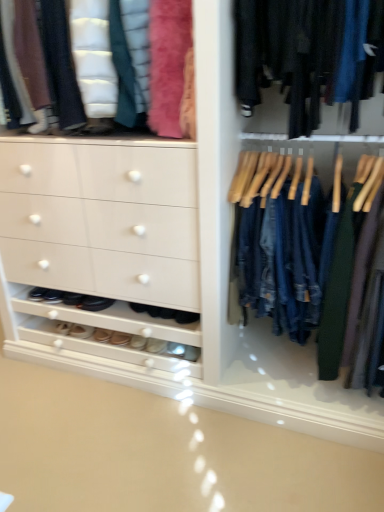
Question: From the image's perspective, is denim jeans at center located above black leather shoes at lower left, the 5th footwear positioned from the right?

Choices:
 (A) yes
 (B) no

Answer: (A)

Question: Can you confirm if denim jeans at center is shorter than black leather shoes at lower left, which ranks as the 2th footwear in left-to-right order?

Choices:
 (A) no
 (B) yes

Answer: (A)

Question: Is denim jeans at center not inside black leather shoes at lower left, which ranks as the 2th footwear in left-to-right order?

Choices:
 (A) yes
 (B) no

Answer: (A)

Question: Can you confirm if denim jeans at center is wider than black leather shoes at lower left, the 5th footwear positioned from the right?

Choices:
 (A) no
 (B) yes

Answer: (B)

Question: Is denim jeans at center bigger than black leather shoes at lower left, which ranks as the 2th footwear in left-to-right order?

Choices:
 (A) no
 (B) yes

Answer: (B)

Question: From the image's perspective, is denim jeans at center under black leather shoes at lower left, the 5th footwear positioned from the right?

Choices:
 (A) no
 (B) yes

Answer: (A)

Question: From the image's perspective, does leather shoes at lower center, which is the fifth footwear from left to right, appear lower than black leather shoes at lower left, the 5th footwear positioned from the right?

Choices:
 (A) no
 (B) yes

Answer: (B)

Question: Considering the relative sizes of leather shoes at lower center, arranged as the second footwear when viewed from the right, and black leather shoes at lower left, which ranks as the 2th footwear in left-to-right order, in the image provided, is leather shoes at lower center, arranged as the second footwear when viewed from the right, smaller than black leather shoes at lower left, which ranks as the 2th footwear in left-to-right order,?

Choices:
 (A) yes
 (B) no

Answer: (A)

Question: Can you confirm if leather shoes at lower center, which is the fifth footwear from left to right, is wider than black leather shoes at lower left, which ranks as the 2th footwear in left-to-right order?

Choices:
 (A) yes
 (B) no

Answer: (B)

Question: Is leather shoes at lower center, arranged as the second footwear when viewed from the right, to the right of black leather shoes at lower left, which ranks as the 2th footwear in left-to-right order, from the viewer's perspective?

Choices:
 (A) yes
 (B) no

Answer: (A)

Question: Considering the relative sizes of leather shoes at lower center, which is the fifth footwear from left to right, and black leather shoes at lower left, which ranks as the 2th footwear in left-to-right order, in the image provided, is leather shoes at lower center, which is the fifth footwear from left to right, taller than black leather shoes at lower left, which ranks as the 2th footwear in left-to-right order,?

Choices:
 (A) no
 (B) yes

Answer: (A)

Question: From a real-world perspective, does leather shoes at lower center, which is the fifth footwear from left to right, sit lower than black leather shoes at lower left, which ranks as the 2th footwear in left-to-right order?

Choices:
 (A) yes
 (B) no

Answer: (A)

Question: Are white leather shoe at lower center, acting as the 4th footwear starting from the left, and leather shoes at lower center, arranged as the second footwear when viewed from the right, located far from each other?

Choices:
 (A) no
 (B) yes

Answer: (A)